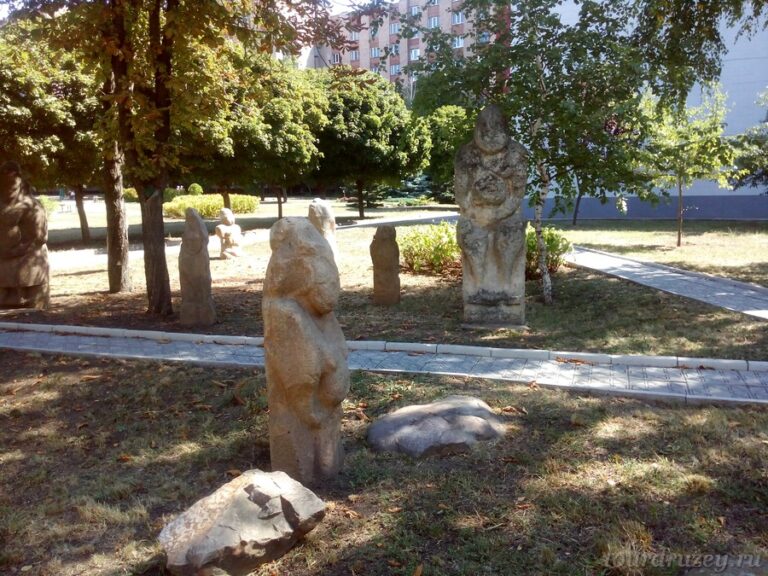
Find the location of a particular element. smaller statue is located at coordinates (227, 232), (323, 221), (385, 264), (196, 293).